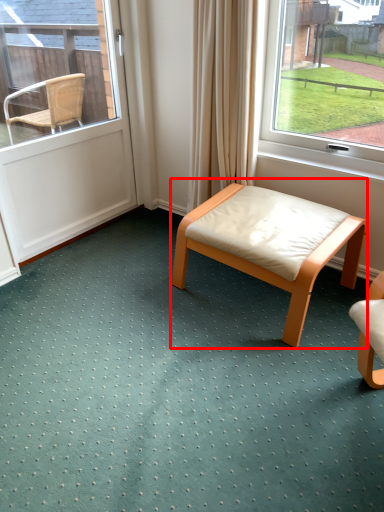
Question: From the image's perspective, where is table (annotated by the red box) located in relation to door in the image?

Choices:
 (A) above
 (B) below

Answer: (B)